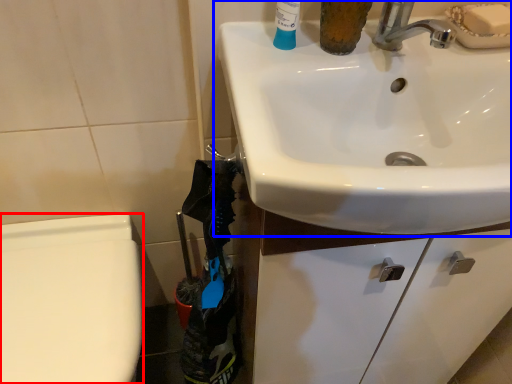
Question: Which object is further to the camera taking this photo, bidet (highlighted by a red box) or sink (highlighted by a blue box)?

Choices:
 (A) bidet
 (B) sink

Answer: (A)